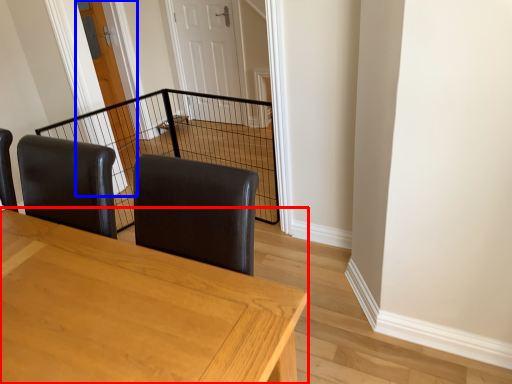
Question: Which object is closer to the camera taking this photo, table (highlighted by a red box) or door (highlighted by a blue box)?

Choices:
 (A) table
 (B) door

Answer: (A)